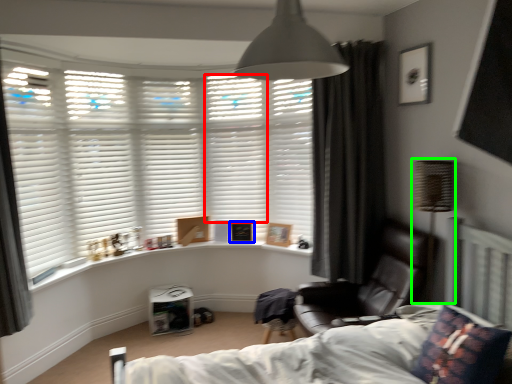
Question: Which object is positioned farthest from shutter (highlighted by a red box)? Select from picture frame (highlighted by a blue box) and table lamp (highlighted by a green box).

Choices:
 (A) picture frame
 (B) table lamp

Answer: (B)